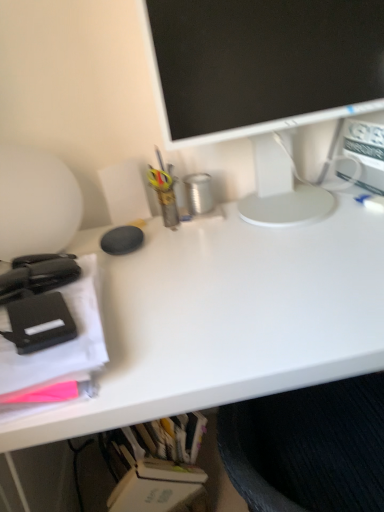
I want to click on vacant area that lies between white glossy monitor at upper center and matte black stapler at left, arranged as the first office supplies when viewed from the front, so click(x=213, y=268).